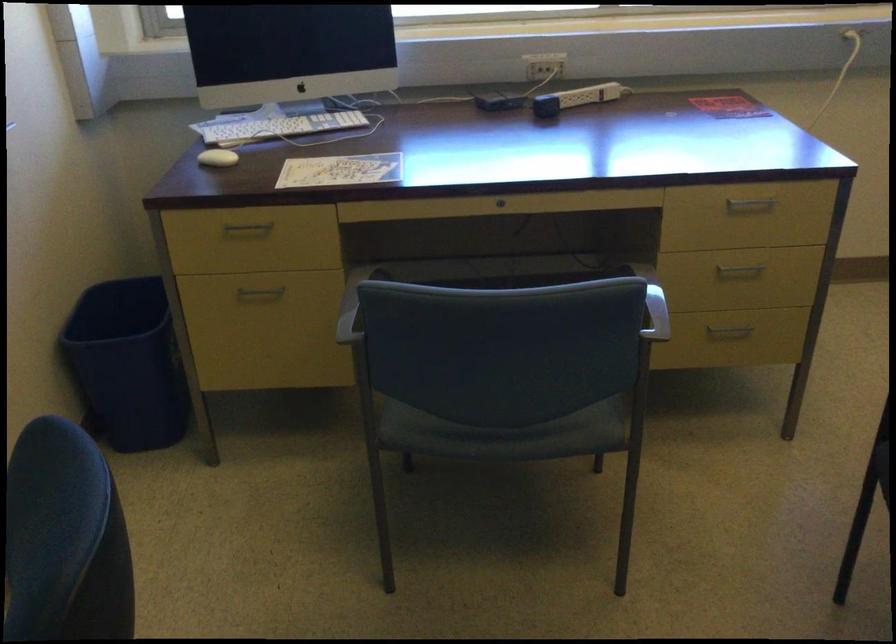
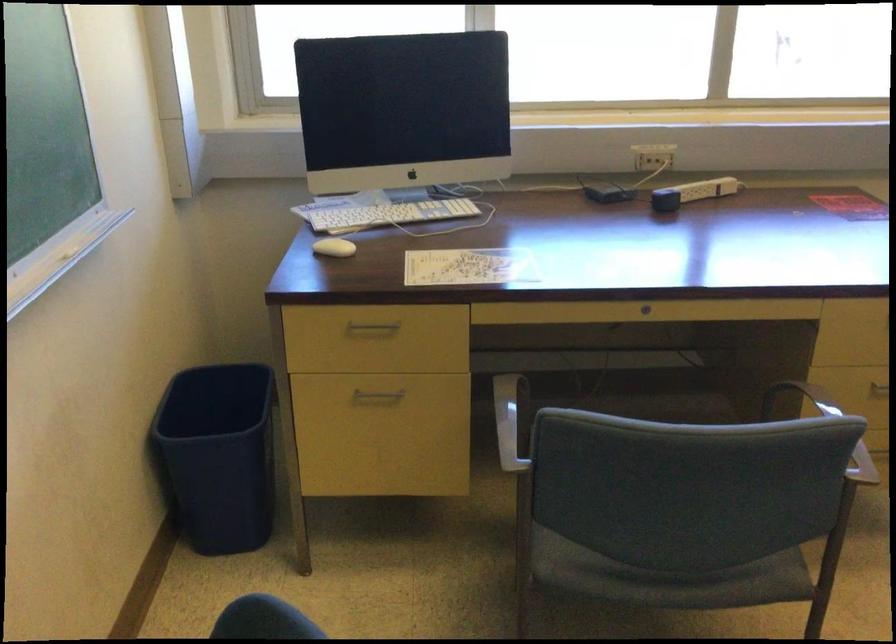
Find the pixel in the second image that matches (124,360) in the first image.

(217, 456)